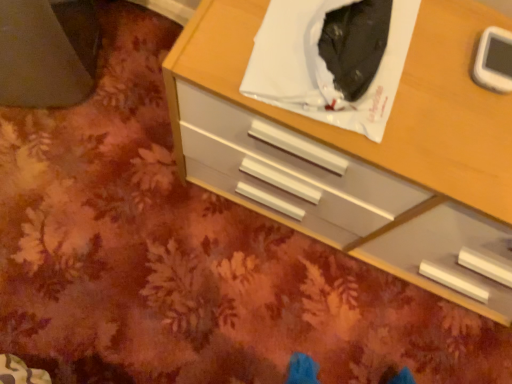
The width and height of the screenshot is (512, 384). In order to click on vacant area situated to the left side of wooden chest of drawers at upper center in this screenshot , I will do `click(119, 183)`.